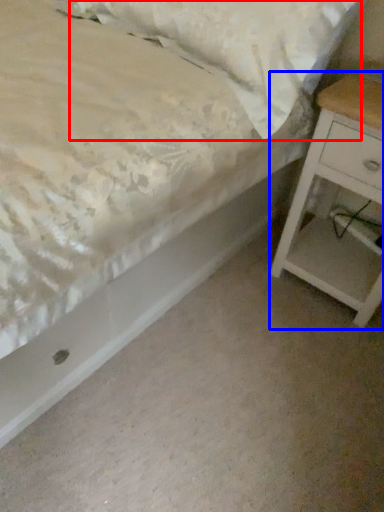
Question: Which point is further to the camera, pillow (highlighted by a red box) or nightstand (highlighted by a blue box)?

Choices:
 (A) pillow
 (B) nightstand

Answer: (B)